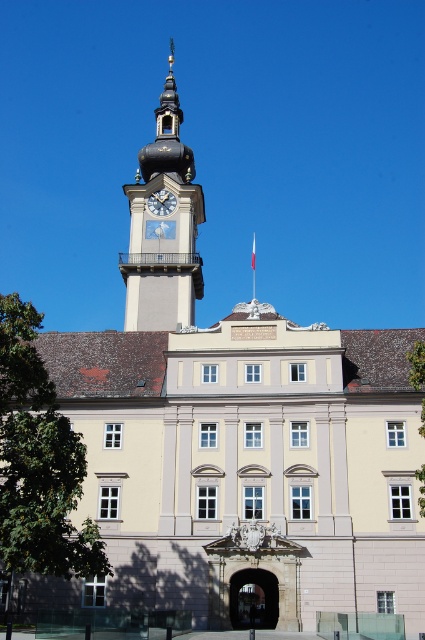
Is gold-plated clock tower at upper center wider than white painted clock at upper center?

Correct, the width of gold-plated clock tower at upper center exceeds that of white painted clock at upper center.

What do you see at coordinates (164, 227) in the screenshot? The height and width of the screenshot is (640, 425). I see `gold-plated clock tower at upper center` at bounding box center [164, 227].

You are a GUI agent. You are given a task and a screenshot of the screen. Output one action in this format:
    pyautogui.click(x=<x>, y=<y>)
    Task: Click on the gold-plated clock tower at upper center
    This screenshot has width=425, height=640.
    Given the screenshot: What is the action you would take?
    pyautogui.click(x=164, y=227)

Does green leafy tree at lower right appear on the right side of white painted clock at upper center?

Yes, green leafy tree at lower right is to the right of white painted clock at upper center.

Does green leafy tree at lower right appear under white painted clock at upper center?

Correct, green leafy tree at lower right is located below white painted clock at upper center.

Does point (413, 349) lie in front of point (166, 212)?

That is True.

You are a GUI agent. You are given a task and a screenshot of the screen. Output one action in this format:
    pyautogui.click(x=<x>, y=<y>)
    Task: Click on the green leafy tree at lower right
    
    Given the screenshot: What is the action you would take?
    pyautogui.click(x=416, y=364)

Is green leafy tree at lower left taller than gold-plated clock tower at upper center?

No, green leafy tree at lower left is not taller than gold-plated clock tower at upper center.

Is green leafy tree at lower left closer to the viewer compared to gold-plated clock tower at upper center?

Yes, green leafy tree at lower left is closer to the viewer.

Is point (36, 355) positioned in front of point (163, 321)?

Yes, it is in front of point (163, 321).

Where is `green leafy tree at lower left`? green leafy tree at lower left is located at coordinates (37, 461).